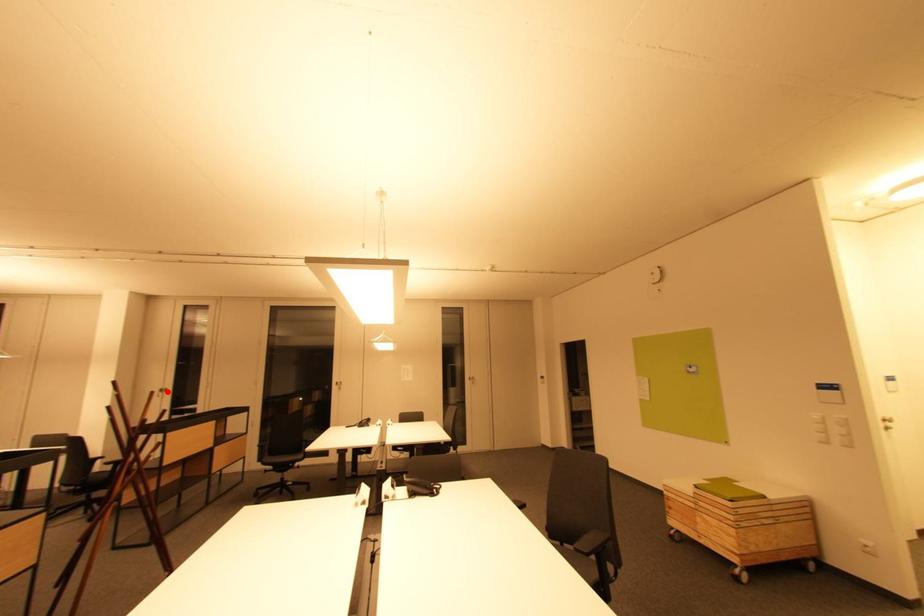
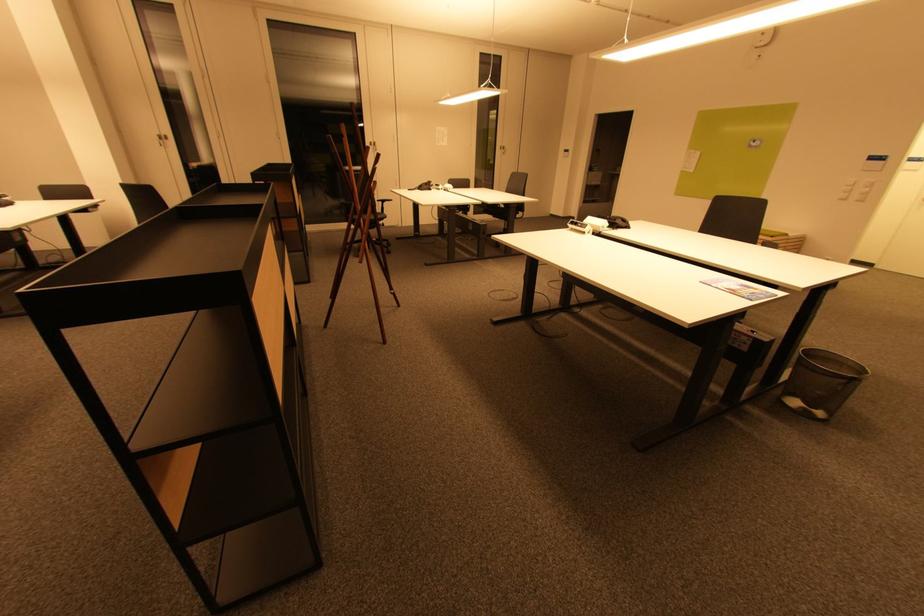
Question: I am providing you with two images of the same scene from different viewpoints. Image1 has a red point marked. In image2, the corresponding 3D location appears at what relative position? Reply with the corresponding letter.

Choices:
 (A) Closer
 (B) Farther

Answer: (B)